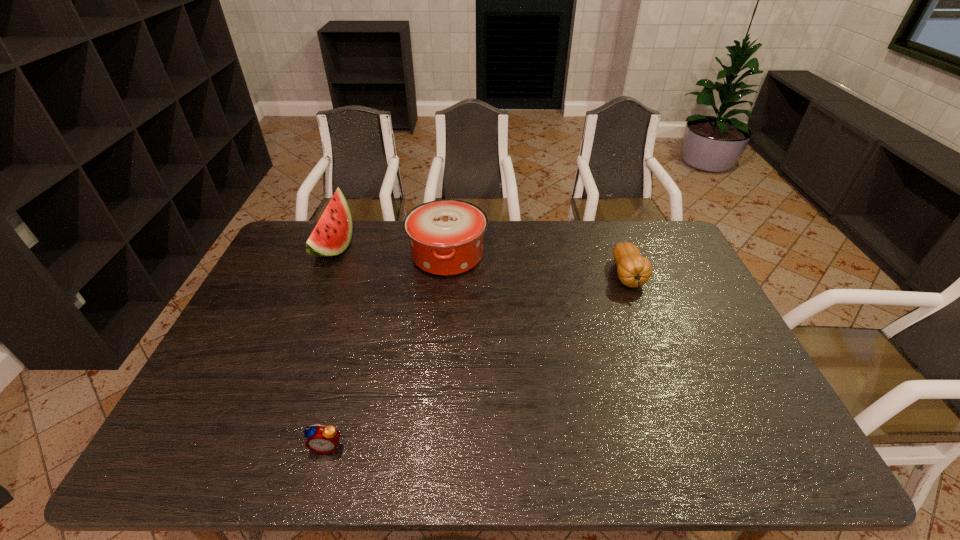
At what (x,y) coordinates should I click in order to perform the action: click on the second object from right to left. Please return your answer as a coordinate pair (x, y). This screenshot has height=540, width=960. Looking at the image, I should click on (446, 236).

Locate an element on the screen. the leftmost object is located at coordinates (331, 236).

Locate an element on the screen. The image size is (960, 540). the rightmost object is located at coordinates (633, 270).

The image size is (960, 540). In order to click on the second object from left to right in this screenshot , I will do `click(322, 439)`.

Identify the location of alarm clock. (322, 439).

Find the location of a particular element. free space located on the left of the casserole is located at coordinates (390, 255).

Identify the location of vacant space located 0.170m on the outer rind of the watermelon. (398, 248).

Where is `vacant space situated on the stem side of the gourd`? vacant space situated on the stem side of the gourd is located at coordinates (662, 366).

Locate an element on the screen. The height and width of the screenshot is (540, 960). casserole that is at the far edge is located at coordinates (446, 236).

Image resolution: width=960 pixels, height=540 pixels. What are the coordinates of `watermelon that is at the far edge` in the screenshot? It's located at (331, 236).